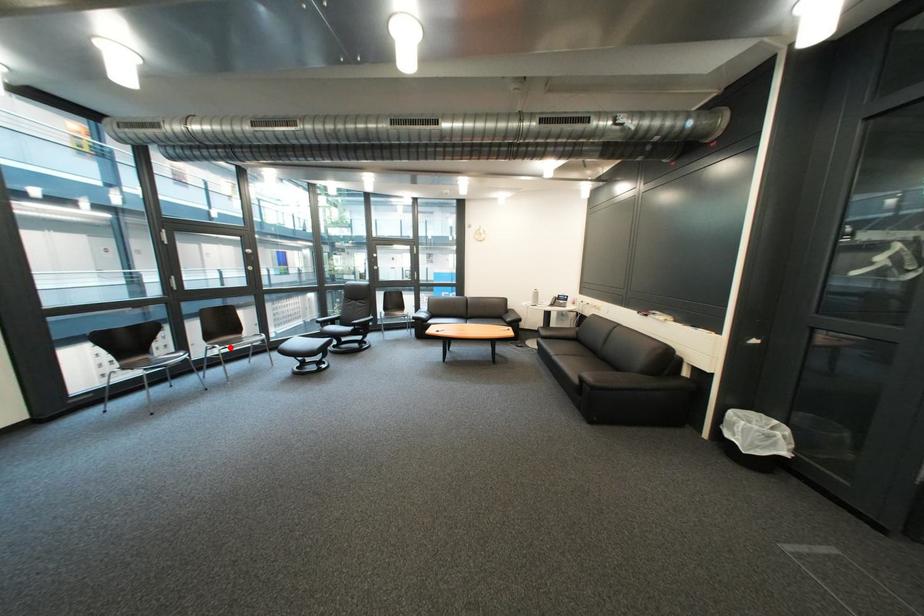
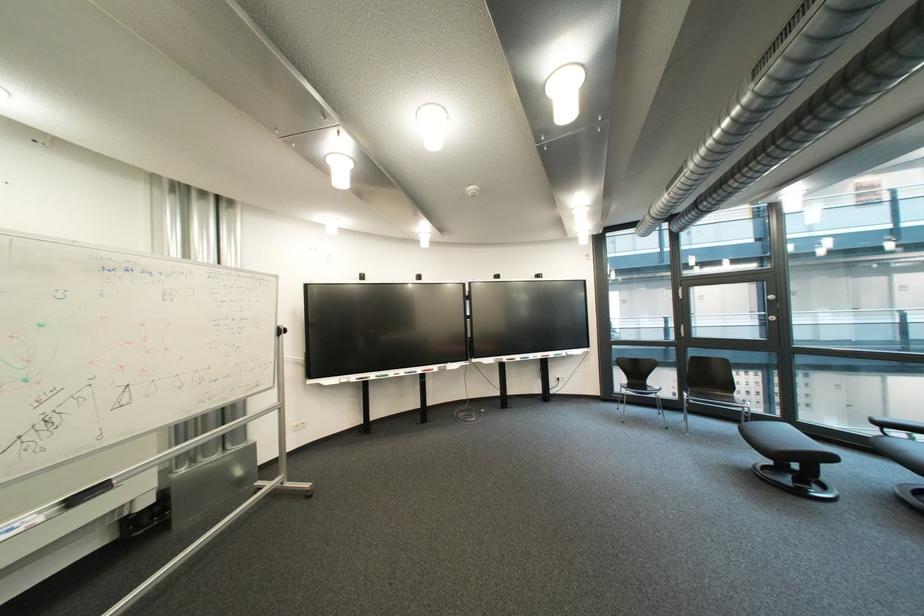
Question: I am providing you with two images of the same scene from different viewpoints. In image1, a red point is highlighted. Considering the same 3D point in image2, which of the following is correct?

Choices:
 (A) It is closer
 (B) It is farther

Answer: (B)